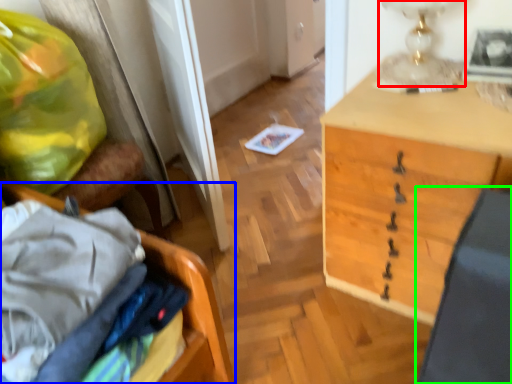
Question: Which object is the closest to the table lamp (highlighted by a red box)? Choose among these: furniture (highlighted by a blue box) or swivel chair (highlighted by a green box).

Choices:
 (A) furniture
 (B) swivel chair

Answer: (B)